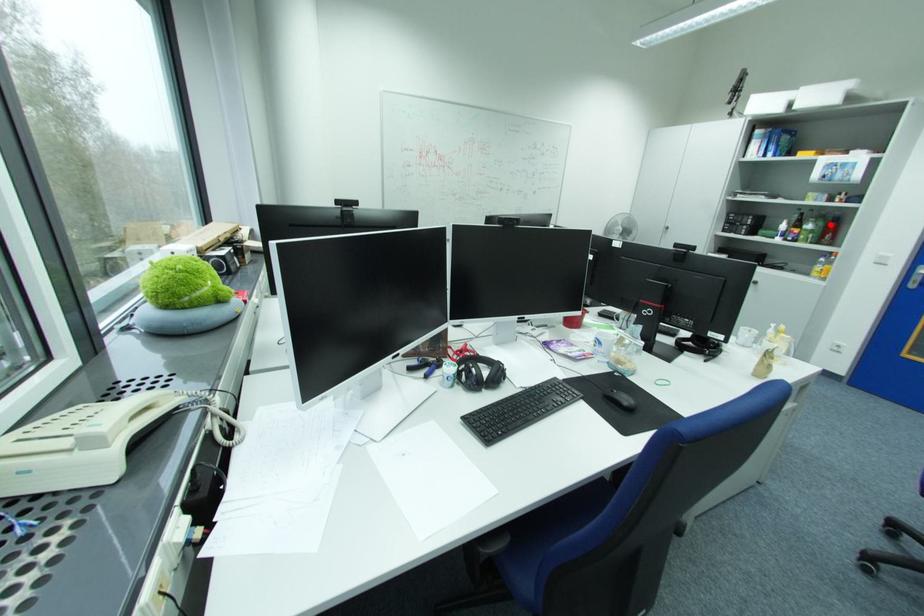
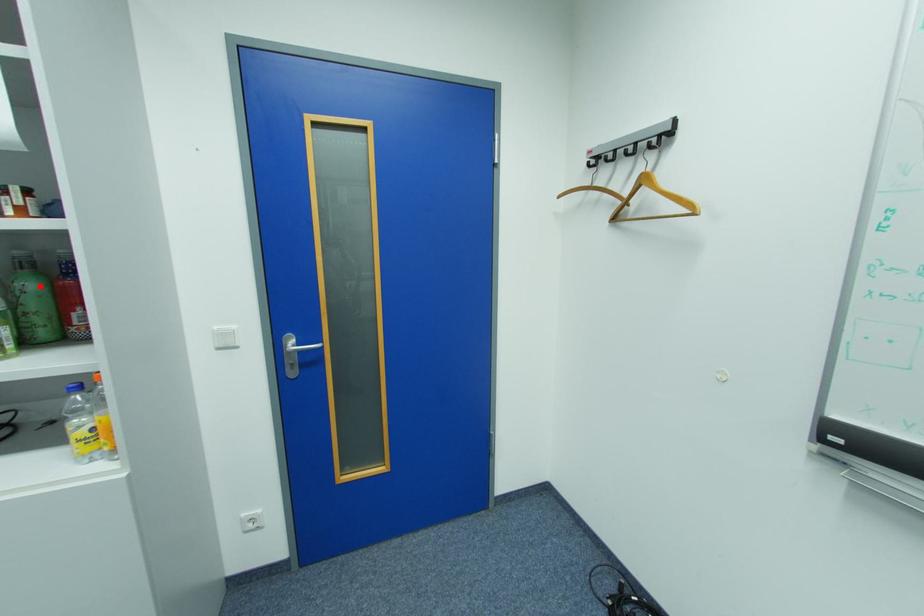
I am providing you with two images of the same scene from different viewpoints. A red point is marked on the first image and another point is marked on the second image. Is the red point in image1 aligned with the point shown in image2?

Yes